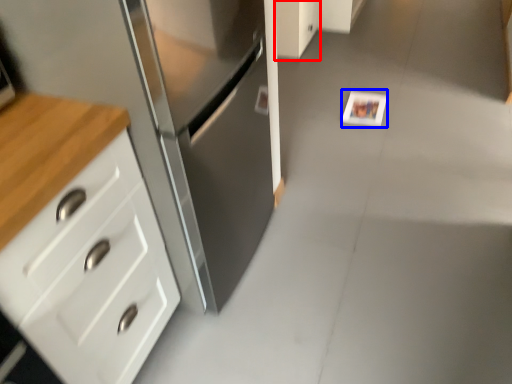
Question: Which point is closer to the camera, cabinetry (highlighted by a red box) or postcard (highlighted by a blue box)?

Choices:
 (A) cabinetry
 (B) postcard

Answer: (B)